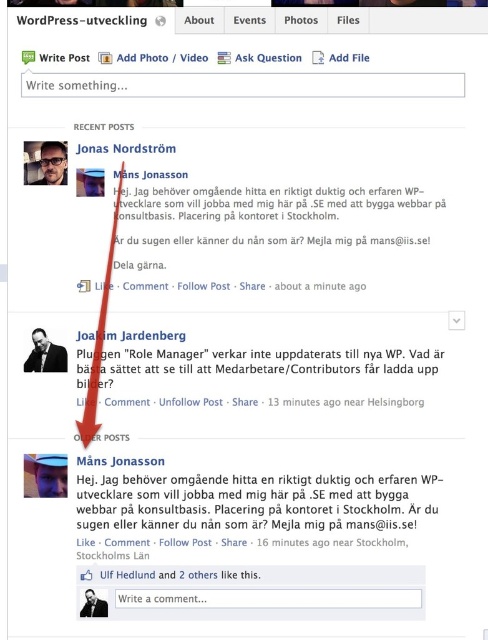
You are a visually impaired user using a screen reader to navigate the Facebook page. The page has two areas of matte black text at center and black matte text at upper left. Which text area is closer to the top of the page?

The black matte text at upper left is closer to the top of the page because it is located at the upper left, while the matte black text at center is positioned lower down.

Jonas Nordstrm has posted a job listing for a WordPress developer. The post includes two sections of text. The first section is the black matte text at upper left, and the second section is the matte black text at center. Which section is located below the other?

The matte black text at center is positioned under the black matte text at upper left.